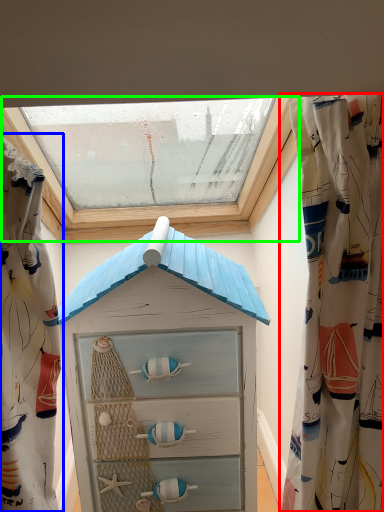
Question: Which is nearer to the curtain (highlighted by a red box)? curtain (highlighted by a blue box) or window (highlighted by a green box).

Choices:
 (A) curtain
 (B) window

Answer: (A)